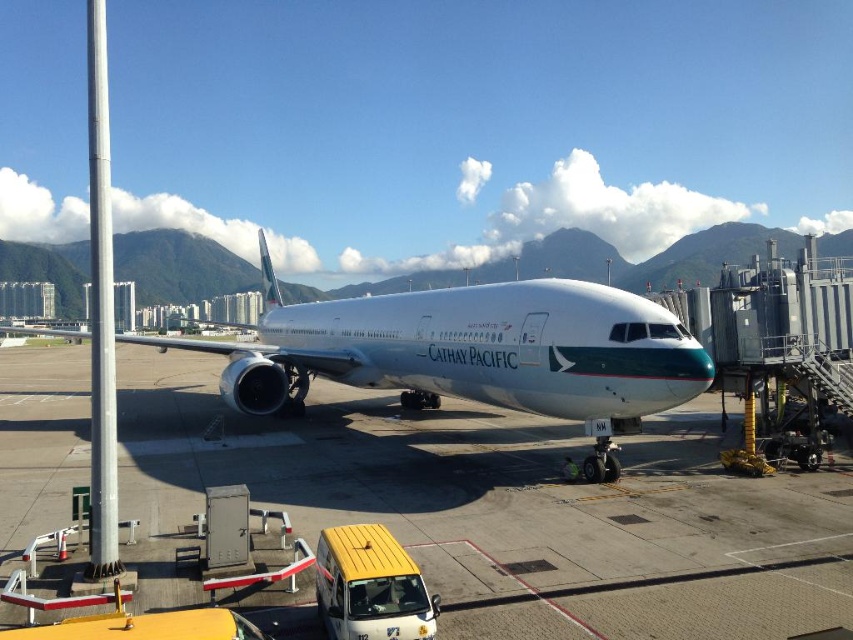
You are a pilot who just landed the Cathay Pacific airplane and need to inspect the tarmac for any obstructions. Where exactly is the white glossy tarmac at center located on the image?

The white glossy tarmac at center is located at the coordinates point (509, 508).

You are a maintenance worker with a 2.5 meter long ladder. You need to place the ladder between the white glossy tarmac at center and the white glossy airplane at center. Will the ladder fit between them?

The white glossy tarmac at center and white glossy airplane at center are 2.41 meters apart from each other. Since the ladder is 2.5 meters long, it is slightly longer than the distance between them. Therefore, the ladder will not fit between the white glossy tarmac at center and white glossy airplane at center.